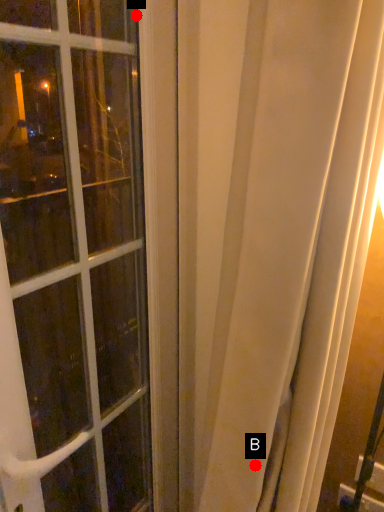
Question: Two points are circled on the image, labeled by A and B beside each circle. Which point is closer to the camera?

Choices:
 (A) A is closer
 (B) B is closer

Answer: (A)